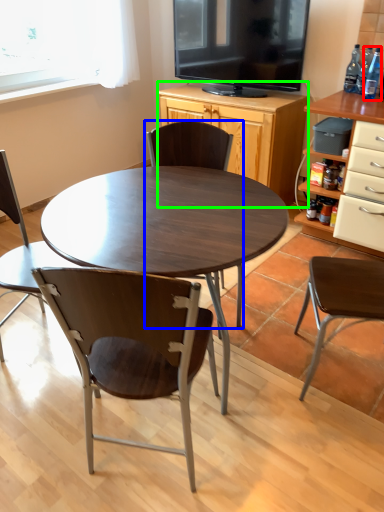
Question: Estimate the real-world distances between objects in this image. Which object is farther from bottle (highlighted by a red box), chair (highlighted by a blue box) or cabinetry (highlighted by a green box)?

Choices:
 (A) chair
 (B) cabinetry

Answer: (A)